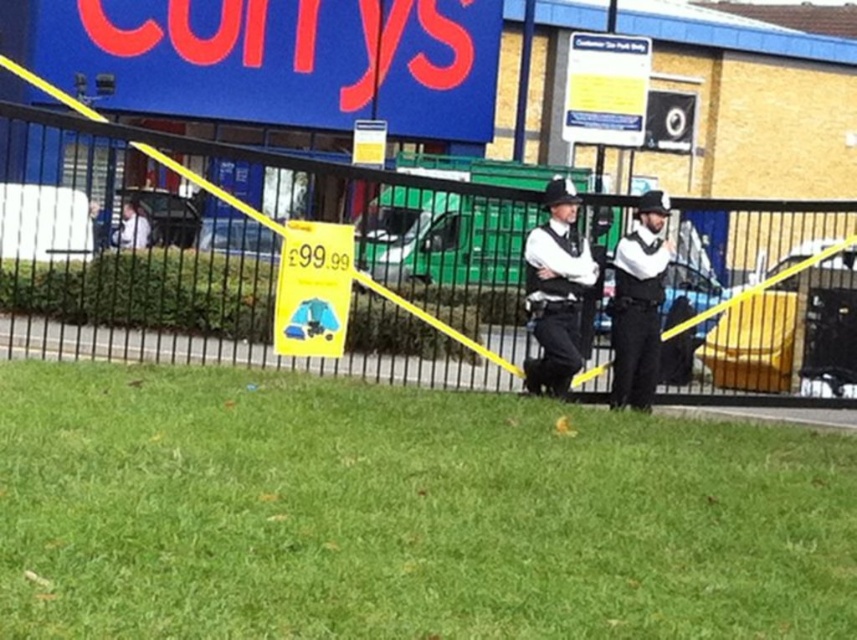
Looking at this image, does black metal fence at center have a lesser width compared to white uniform at center?

No, black metal fence at center is not thinner than white uniform at center.

Based on the photo, which of these two, black metal fence at center or white uniform at center, stands taller?

black metal fence at center

Between point (741, 230) and point (553, 236), which one is positioned behind?

The point (741, 230) is behind.

What are the coordinates of `black metal fence at center` in the screenshot? It's located at (207, 276).

Looking at this image, can you confirm if white uniform at center is smaller than white uniformed officer at center?

Actually, white uniform at center might be larger than white uniformed officer at center.

Between point (574, 353) and point (650, 323), which one is positioned in front?

Point (574, 353) is more forward.

I want to click on white uniform at center, so click(x=556, y=291).

Is point (586, 196) less distant than point (628, 396)?

No, (586, 196) is further to viewer.

Can you confirm if black metal fence at center is taller than white uniformed officer at center?

Yes.

You are a GUI agent. You are given a task and a screenshot of the screen. Output one action in this format:
    pyautogui.click(x=<x>, y=<y>)
    Task: Click on the black metal fence at center
    The width and height of the screenshot is (857, 640).
    Given the screenshot: What is the action you would take?
    pyautogui.click(x=207, y=276)

Identify the location of black metal fence at center. (207, 276).